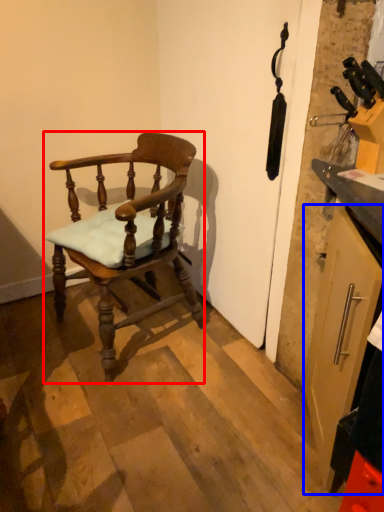
Question: Which object appears closest to the camera in this image, chair (highlighted by a red box) or cabinetry (highlighted by a blue box)?

Choices:
 (A) chair
 (B) cabinetry

Answer: (B)